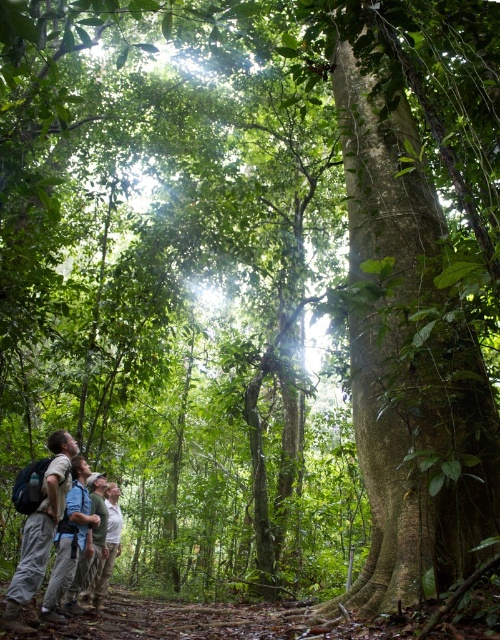
Identify the location of light brown backpack at lower left. (40, 531).

Who is shorter, light brown backpack at lower left or light gray shirt at lower center?

light brown backpack at lower left is shorter.

Identify the location of light brown backpack at lower left. The image size is (500, 640). pyautogui.click(x=40, y=531).